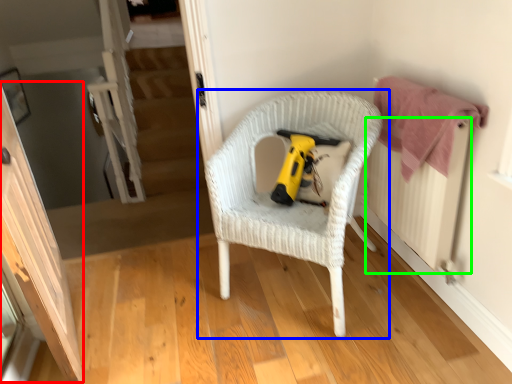
Question: Estimate the real-world distances between objects in this image. Which object is farther from screen door (highlighted by a red box), chair (highlighted by a blue box) or radiator (highlighted by a green box)?

Choices:
 (A) chair
 (B) radiator

Answer: (B)